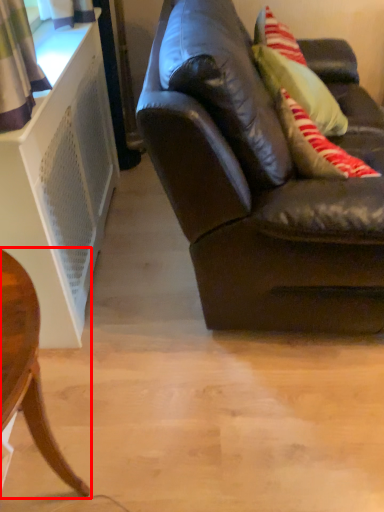
Question: From the image's perspective, what is the correct spatial relationship of chair (annotated by the red box) in relation to studio couch?

Choices:
 (A) below
 (B) above

Answer: (A)